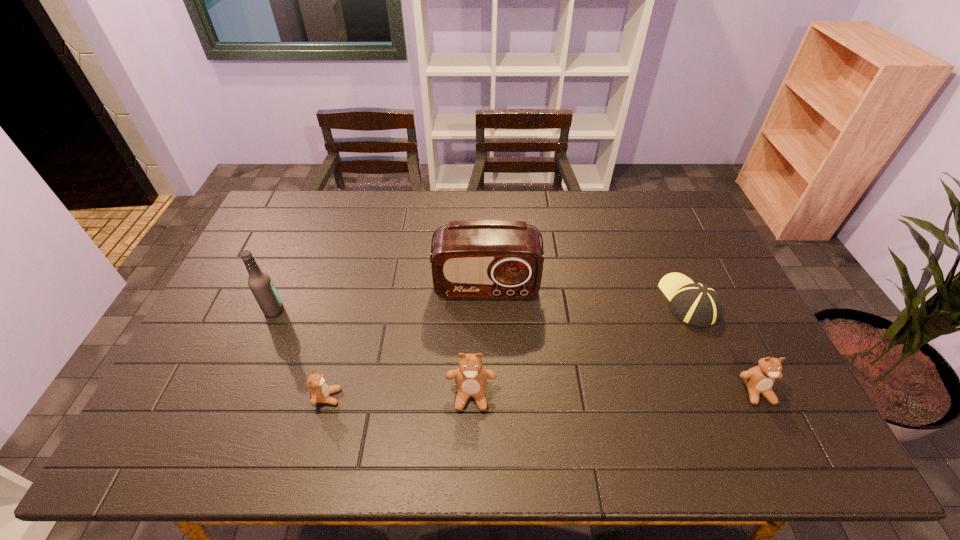
Please point a spot to place another teddy_bear for symmetrical spacing. Please provide its 2D coordinates. Your answer should be formatted as a tuple, i.e. [(x, y)], where the tuple contains the x and y coordinates of a point satisfying the conditions above.

[(614, 394)]